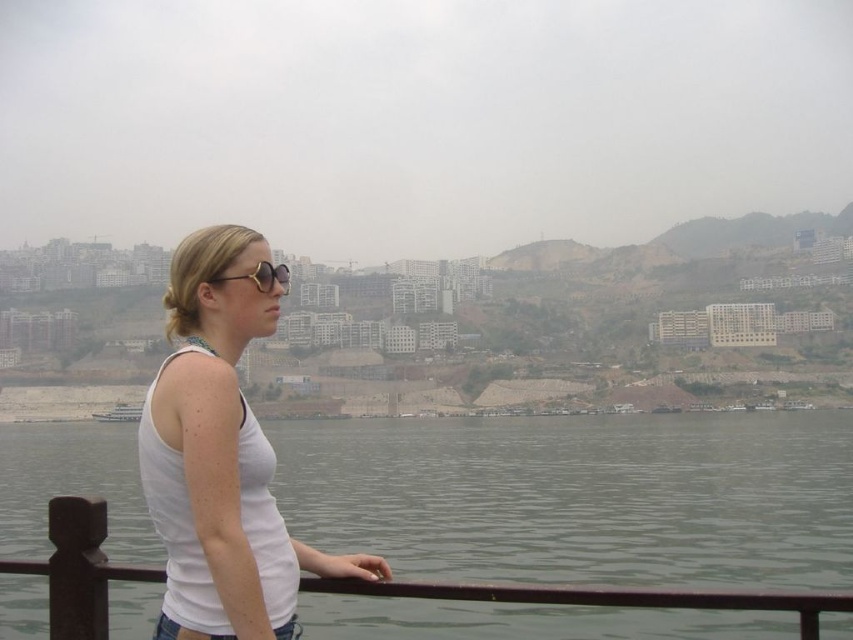
Consider the image. You are a photographer positioned at the center of the scene. You want to capture a closeup shot of the white matte tank top at center. Your camera has a minimum focusing distance of 40 meters. Can you take the photo without moving closer?

The distance between you and the white matte tank top at center is 39.28 meters, which is less than the camera minimum focusing distance of 40 meters. Therefore, you cannot take the photo without moving closer.

You are a photographer planning to take a wide shot of the scene. The clear water at lower left and the white glossy boat at lower center are both in your frame. Which object occupies more horizontal space in the photo?

The clear water at lower left occupies more horizontal space in the photo because its width surpasses that of the white glossy boat at lower center.